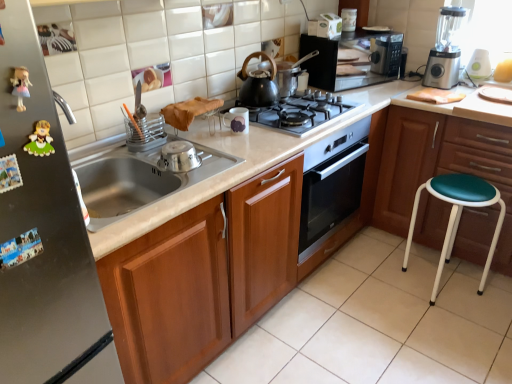
Image resolution: width=512 pixels, height=384 pixels. I want to click on free area below satin silver blender at upper right (from a real-world perspective), so click(437, 87).